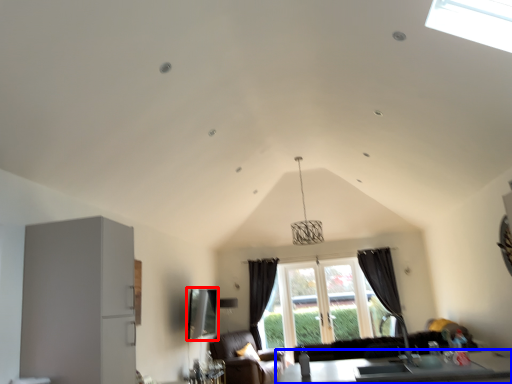
Question: Which point is closer to the camera, window screen (highlighted by a red box) or table (highlighted by a blue box)?

Choices:
 (A) window screen
 (B) table

Answer: (B)